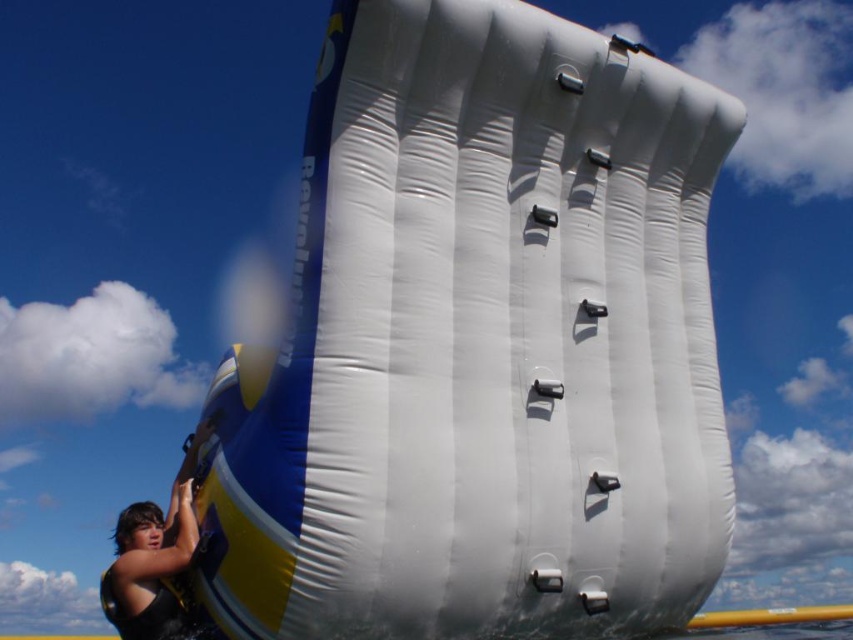
You are planning to climb the white inflatable wall at center and need to step on the black fabric at left for support. Given the size difference between them, which one should you focus your weight on to maintain balance?

The white inflatable wall at center is larger in size than the black fabric at left, so you should focus your weight on the white inflatable wall at center for better support and balance.

You are standing at the base of the inflatable rock wall and want to reach the point marked as point (421,144). If your maximum reach distance is 40 feet, can you touch this point without moving closer?

The point (421,144) is 44.34 feet away from the viewer, which exceeds your maximum reach distance of 40 feet. Therefore, you cannot touch this point without moving closer.

You are organizing a water sports event and need to place a 3m wide equipment container next to the white inflatable wall at center and the black fabric at left. Which object should the container be placed next to to ensure it fits without overlapping?

The white inflatable wall at center has a larger width than the black fabric at left, so the container should be placed next to the white inflatable wall at center to ensure it fits without overlapping.